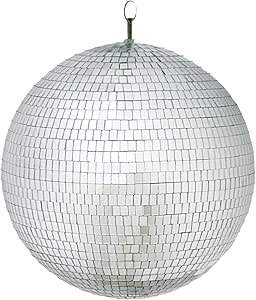
At what (x,y) coordinates should I click in order to perform the action: click on hook. Please return your answer as a coordinate pair (x, y). Looking at the image, I should click on (125, 8).